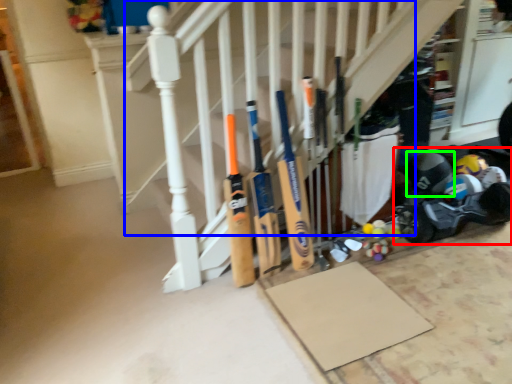
Question: Estimate the real-world distances between objects in this image. Which object is closer to baby carriage (highlighted by a red box), stairs (highlighted by a blue box) or helmet (highlighted by a green box)?

Choices:
 (A) stairs
 (B) helmet

Answer: (B)